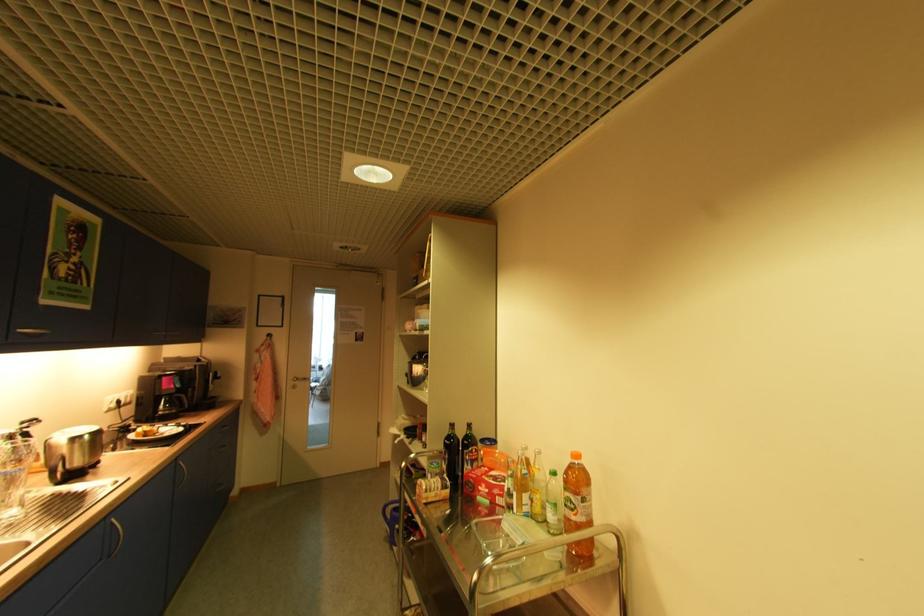
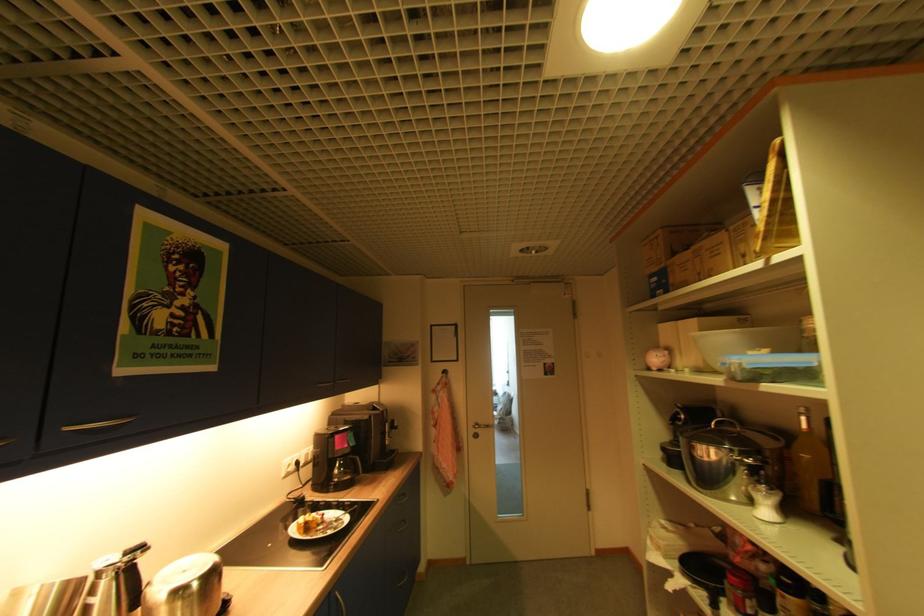
Locate, in the second image, the point that corresponds to [101,429] in the first image.

(217, 562)